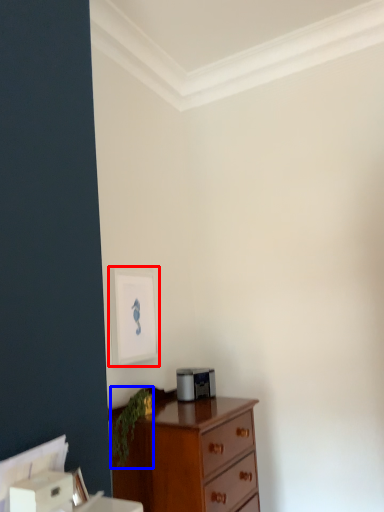
Question: Which point is further to the camera, picture frame (highlighted by a red box) or plant (highlighted by a blue box)?

Choices:
 (A) picture frame
 (B) plant

Answer: (A)